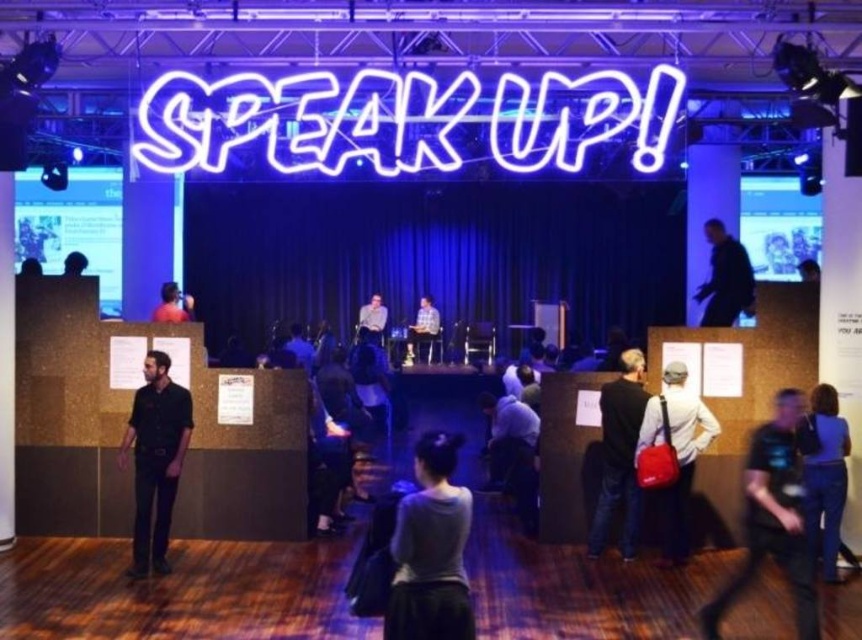
Question: Can you confirm if blue fabric jacket at lower right is thinner than matte red shirt at center?

Choices:
 (A) yes
 (B) no

Answer: (B)

Question: Which point appears farthest from the camera in this image?

Choices:
 (A) (809, 572)
 (B) (63, 273)
 (C) (684, 449)

Answer: (B)

Question: Which of the following is the closest to the observer?

Choices:
 (A) gray matte sweater at center
 (B) black leather jacket at center

Answer: (A)

Question: Can you confirm if black matte shirt at left is positioned to the left of blue fabric jacket at lower right?

Choices:
 (A) no
 (B) yes

Answer: (B)

Question: Can you confirm if black matte shirt at left is positioned below light brown leather jacket at center?

Choices:
 (A) no
 (B) yes

Answer: (B)

Question: Which point is farther to the camera?

Choices:
 (A) (80, 273)
 (B) (665, 556)
 (C) (713, 312)

Answer: (A)